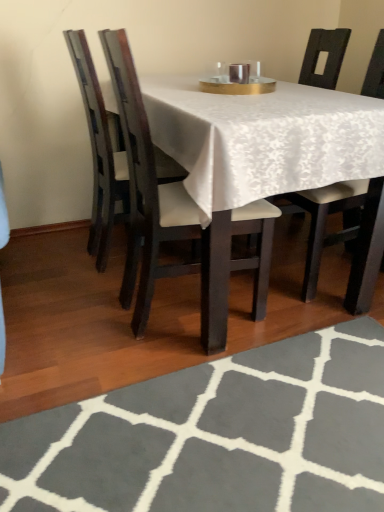
This screenshot has width=384, height=512. Find the location of `vacant area that lies in front of matte black chair at left, arranged as the first chair when viewed from the left`. vacant area that lies in front of matte black chair at left, arranged as the first chair when viewed from the left is located at coordinates (81, 298).